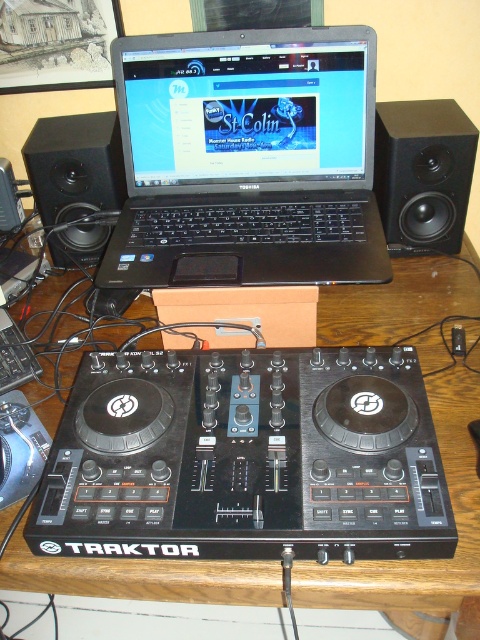
Question: Which point appears closest to the camera in this image?

Choices:
 (A) (40, 195)
 (B) (446, 541)
 (C) (157, 120)
 (D) (57, 582)

Answer: (B)

Question: Which point appears closest to the camera in this image?

Choices:
 (A) (335, 536)
 (B) (160, 579)
 (C) (74, 198)

Answer: (A)

Question: Is wooden at center smaller than black matte speaker at right?

Choices:
 (A) yes
 (B) no

Answer: (B)

Question: Is black plastic laptop at center below wooden at center?

Choices:
 (A) yes
 (B) no

Answer: (B)

Question: Which point is farther to the camera?

Choices:
 (A) black matte speaker at left
 (B) black matte speaker at right
 (C) wooden at center
 (D) black plastic dj controller at center

Answer: (A)

Question: Does black plastic laptop at center appear on the right side of black matte speaker at right?

Choices:
 (A) no
 (B) yes

Answer: (A)